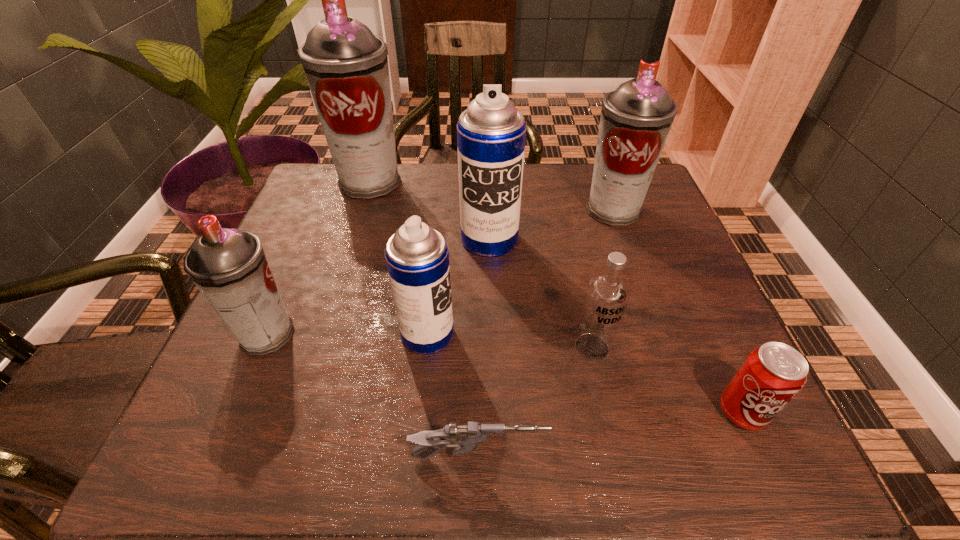
Where is `the sixth object from left to right`? Image resolution: width=960 pixels, height=540 pixels. the sixth object from left to right is located at coordinates (607, 293).

This screenshot has width=960, height=540. Find the location of `the second shortest object`. the second shortest object is located at coordinates (771, 376).

Locate an element on the screen. soda is located at coordinates (771, 376).

The image size is (960, 540). What are the coordinates of `gun` in the screenshot? It's located at (466, 438).

Where is `the nearest object`? Image resolution: width=960 pixels, height=540 pixels. the nearest object is located at coordinates pos(466,438).

Find the location of a particular element. Image resolution: width=960 pixels, height=540 pixels. vacant space located on the front of the tallest object is located at coordinates (339, 276).

Locate an element on the screen. vacant space located on the back of the rightmost gray aerosol can is located at coordinates (597, 165).

Where is `free space located on the label side of the bigger blue aerosol can`? This screenshot has height=540, width=960. free space located on the label side of the bigger blue aerosol can is located at coordinates (491, 302).

You are a GUI agent. You are given a task and a screenshot of the screen. Output one action in this format:
    pyautogui.click(x=<x>, y=<y>)
    Task: Click on the free space located 0.290m on the label side of the third aerosol can from right to left
    
    Given the screenshot: What is the action you would take?
    pyautogui.click(x=608, y=334)

What are the coordinates of `vacant point located on the back of the nearest gray aerosol can` in the screenshot? It's located at (326, 195).